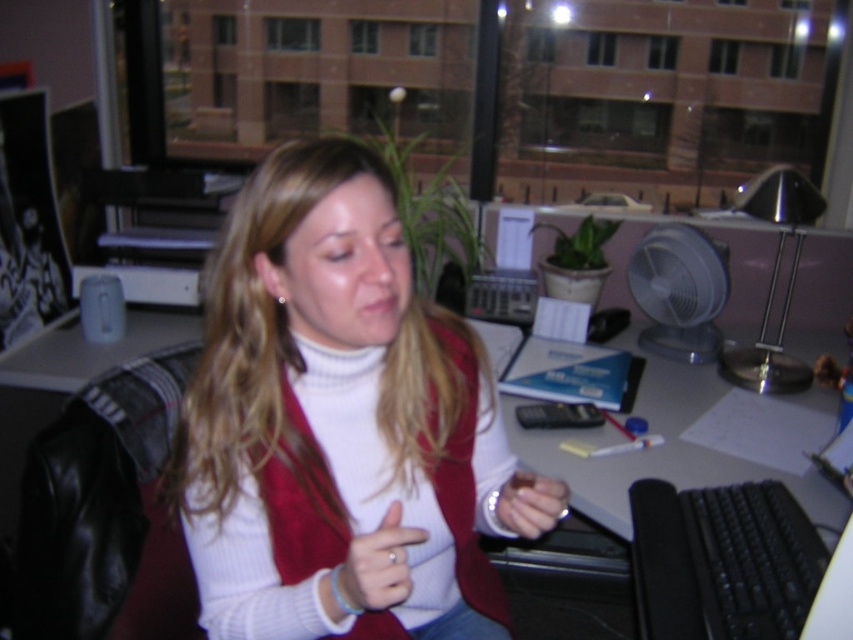
You are a delivery robot with a package that needs to be placed on the desk. The package is 1.2 meters long. Can you place the package horizontally between the clear plastic fan at right and matte silver ring at center without it overlapping either object?

The distance between the clear plastic fan at right and matte silver ring at center is 1.00 meters. Since the package is 1.2 meters long, it would overlap both objects when placed horizontally between them.

You are an office assistant who needs to retrieve the matte silver ring at center from the desk. The matte white hand at center is currently blocking access to it. Can you move the hand to reach the ring?

The matte white hand at center is located below the matte silver ring at center, so moving the hand upwards would allow access to the ring.

Based on the photo, you are organizing a desk and need to place the white soft sweater at center and the black plastic keyboard at lower right. According to the description, which object is positioned to the left of the other?

The white soft sweater at center is positioned to the left of the black plastic keyboard at lower right.